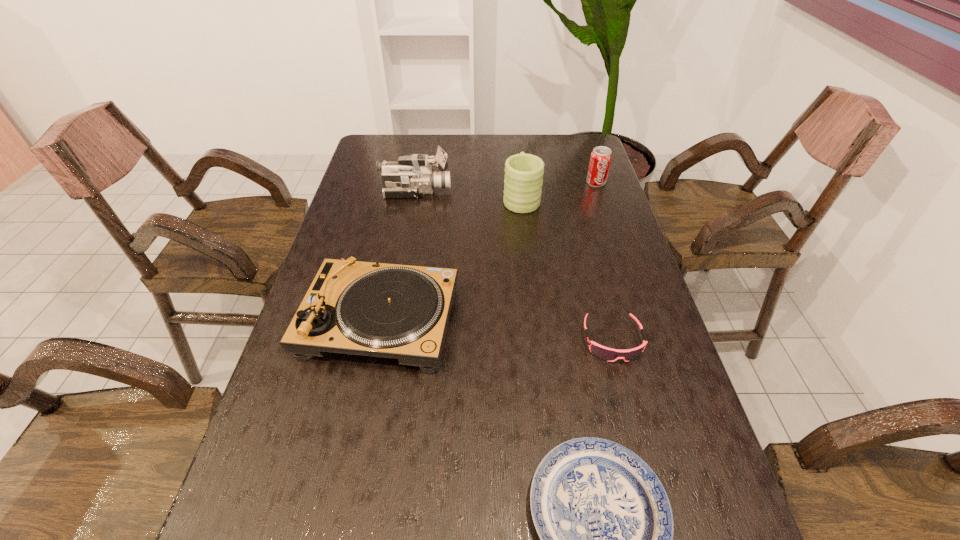
The width and height of the screenshot is (960, 540). Identify the location of camcorder. (413, 175).

Locate an element on the screen. The width and height of the screenshot is (960, 540). mug is located at coordinates (523, 180).

Locate an element on the screen. soda can is located at coordinates (601, 156).

Find the location of a particular element. This screenshot has height=540, width=960. record player is located at coordinates (395, 311).

You are a GUI agent. You are given a task and a screenshot of the screen. Output one action in this format:
    pyautogui.click(x=<x>, y=<y>)
    Task: Click on the goggles
    This screenshot has height=540, width=960.
    Given the screenshot: What is the action you would take?
    pyautogui.click(x=608, y=354)

The image size is (960, 540). What are the coordinates of `vacant space located on the front-facing side of the camcorder` in the screenshot? It's located at (511, 191).

Where is `vacant space located 0.250m on the side of the mug with the handle`? The width and height of the screenshot is (960, 540). vacant space located 0.250m on the side of the mug with the handle is located at coordinates (516, 147).

Image resolution: width=960 pixels, height=540 pixels. I want to click on vacant area situated on the side of the mug with the handle, so click(516, 155).

Where is `free location located on the side of the mug with the handle`? The height and width of the screenshot is (540, 960). free location located on the side of the mug with the handle is located at coordinates 515,136.

Identify the location of vacant point located on the front of the soda can. Image resolution: width=960 pixels, height=540 pixels. (612, 231).